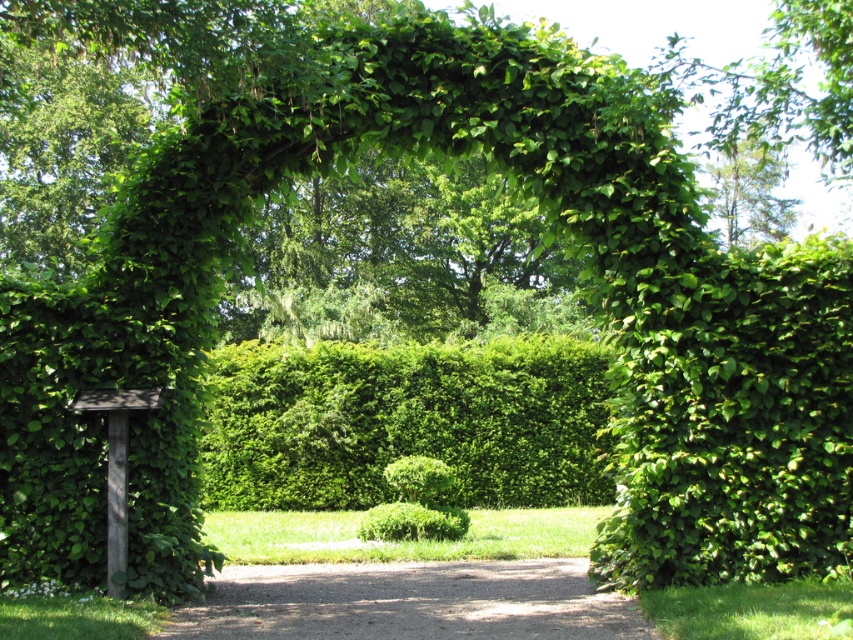
Question: Which point appears farthest from the camera in this image?

Choices:
 (A) (564, 596)
 (B) (409, 440)

Answer: (B)

Question: Which object is farther from the camera taking this photo?

Choices:
 (A) green leafy tree at upper center
 (B) brown gravel path at center
 (C) green leafy hedge at center

Answer: (C)

Question: Is brown gravel path at center positioned behind green leafy tree at upper center?

Choices:
 (A) no
 (B) yes

Answer: (A)

Question: Is green leafy hedge at center to the left of green leafy tree at upper center from the viewer's perspective?

Choices:
 (A) yes
 (B) no

Answer: (A)

Question: Can you confirm if green leafy hedge at center is wider than brown gravel path at center?

Choices:
 (A) yes
 (B) no

Answer: (B)

Question: Which point is closer to the camera?

Choices:
 (A) (401, 404)
 (B) (733, 196)

Answer: (A)